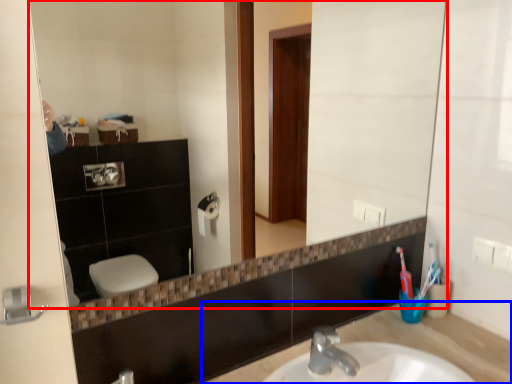
Question: Which object is closer to the camera taking this photo, mirror (highlighted by a red box) or counter top (highlighted by a blue box)?

Choices:
 (A) mirror
 (B) counter top

Answer: (A)